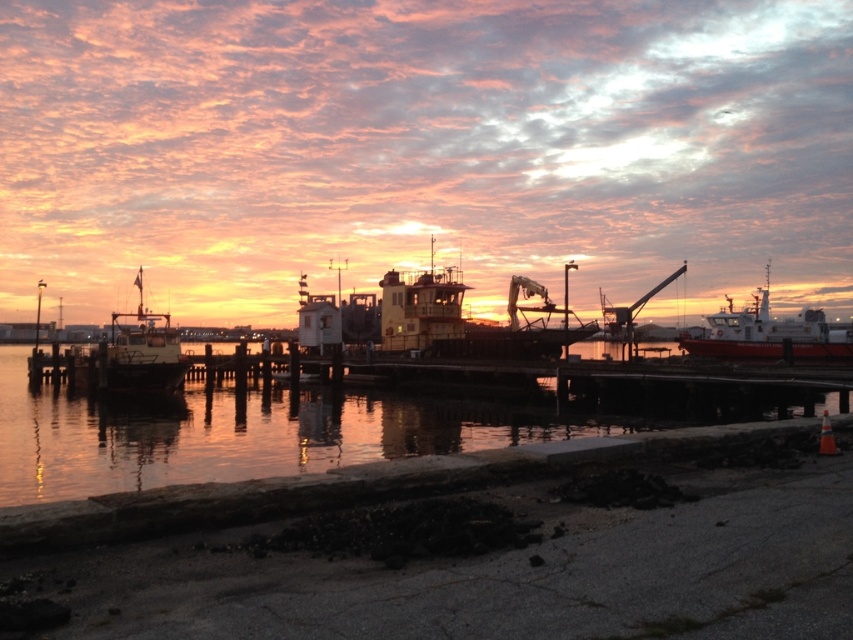
Question: Estimate the real-world distances between objects in this image. Which object is closer to the glossy water at center?

Choices:
 (A) yellow matte boat at center
 (B) red matte boat at right

Answer: (A)

Question: Which is nearer to the matte white boat at left?

Choices:
 (A) glossy water at center
 (B) red matte boat at right
 (C) yellow matte boat at center

Answer: (A)

Question: Can you confirm if glossy water at center is positioned above red matte boat at right?

Choices:
 (A) no
 (B) yes

Answer: (A)

Question: From the image, what is the correct spatial relationship of glossy water at center in relation to matte white boat at left?

Choices:
 (A) above
 (B) below

Answer: (B)

Question: Can you confirm if glossy water at center is smaller than yellow matte boat at center?

Choices:
 (A) no
 (B) yes

Answer: (B)

Question: Among these objects, which one is nearest to the camera?

Choices:
 (A) red matte boat at right
 (B) yellow matte boat at center
 (C) glossy water at center
 (D) matte white boat at left

Answer: (C)